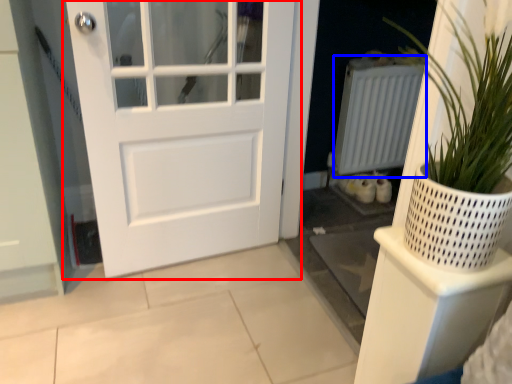
Question: Which object is closer to the camera taking this photo, door (highlighted by a red box) or radiator (highlighted by a blue box)?

Choices:
 (A) door
 (B) radiator

Answer: (A)